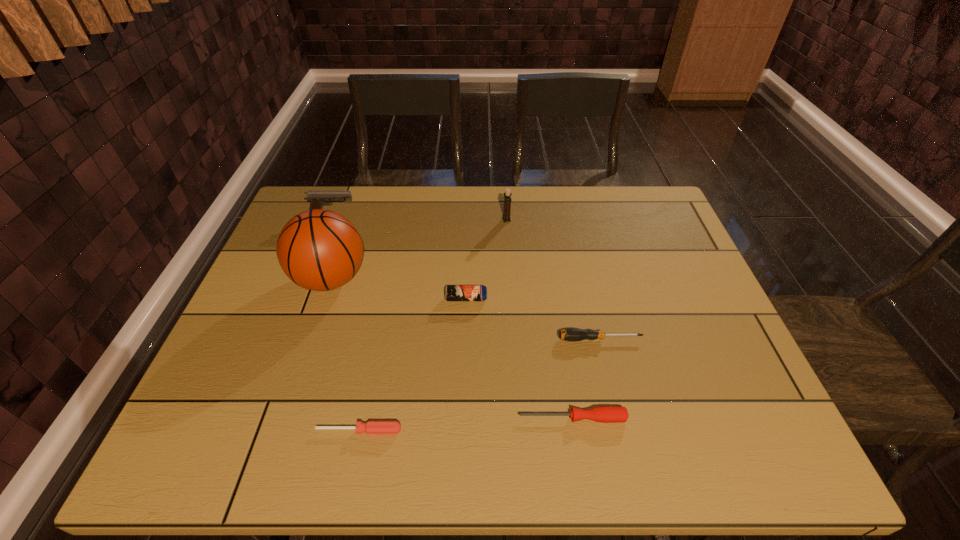
You are a GUI agent. You are given a task and a screenshot of the screen. Output one action in this format:
    pyautogui.click(x=<x>, y=<y>)
    Task: Click on the free spot located on the right of the tallest object
    The image size is (960, 540).
    Given the screenshot: What is the action you would take?
    pyautogui.click(x=423, y=280)

Where is `blank space located on the left of the second tallest object`? blank space located on the left of the second tallest object is located at coordinates (420, 219).

You are a GUI agent. You are given a task and a screenshot of the screen. Output one action in this format:
    pyautogui.click(x=<x>, y=<y>)
    Task: Click on the free space located at the barrel of the fifth shortest object
    The image size is (960, 540).
    Given the screenshot: What is the action you would take?
    pos(402,215)

What are the coordinates of `vacant area situated 0.130m on the back of the fourth object from left to right` in the screenshot? It's located at (468, 260).

Locate an element on the screen. The height and width of the screenshot is (540, 960). vacant space located 0.160m on the front of the tallest screwdriver is located at coordinates (615, 406).

Find the location of `vacant area situated 0.060m at the tip of the second farthest screwdriver`. vacant area situated 0.060m at the tip of the second farthest screwdriver is located at coordinates (490, 418).

Locate an element on the screen. vacant region located 0.290m at the tip of the second farthest screwdriver is located at coordinates (379, 418).

Locate an element on the screen. The image size is (960, 540). vacant point located 0.160m at the tip of the second farthest screwdriver is located at coordinates (442, 418).

Where is `free spot located 0.190m on the left of the nearest object`? This screenshot has height=540, width=960. free spot located 0.190m on the left of the nearest object is located at coordinates (224, 430).

Image resolution: width=960 pixels, height=540 pixels. In order to click on candle holder located in the far edge section of the desktop in this screenshot , I will do `click(507, 195)`.